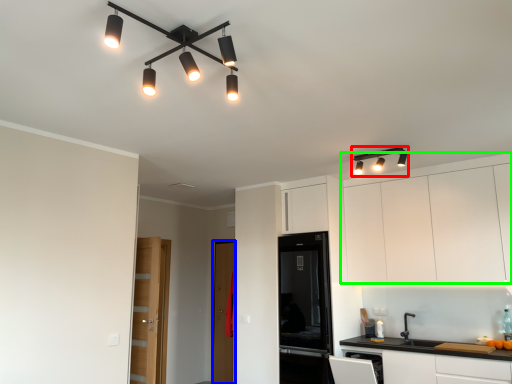
Question: Which object is the closest to the light fixture (highlighted by a red box)? Choose among these: glass door (highlighted by a blue box) or cabinetry (highlighted by a green box).

Choices:
 (A) glass door
 (B) cabinetry

Answer: (B)